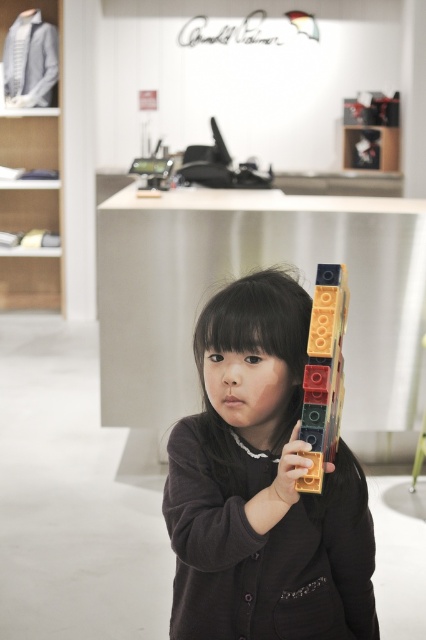
Can you confirm if matte plastic blocks at center is taller than gold plastic toy blocks at center?

Correct, matte plastic blocks at center is much taller as gold plastic toy blocks at center.

Can you confirm if matte plastic blocks at center is positioned to the left of gold plastic toy blocks at center?

Indeed, matte plastic blocks at center is positioned on the left side of gold plastic toy blocks at center.

Identify the location of matte plastic blocks at center. The image size is (426, 640). (261, 486).

Can you confirm if matte plastic blocks at center is smaller than translucent plastic blocks at center?

No, matte plastic blocks at center is not smaller than translucent plastic blocks at center.

In the scene shown: Is matte plastic blocks at center to the left of translucent plastic blocks at center from the viewer's perspective?

Indeed, matte plastic blocks at center is positioned on the left side of translucent plastic blocks at center.

The width and height of the screenshot is (426, 640). Identify the location of matte plastic blocks at center. (261, 486).

Locate an element on the screen. Image resolution: width=426 pixels, height=640 pixels. translucent plastic blocks at center is located at coordinates (324, 372).

Who is more forward, (308,348) or (290,444)?

Positioned in front is point (290,444).

Does point (321, 296) come closer to viewer compared to point (291, 493)?

No, it is behind (291, 493).

Identify the location of translucent plastic blocks at center. The width and height of the screenshot is (426, 640). coord(324,372).